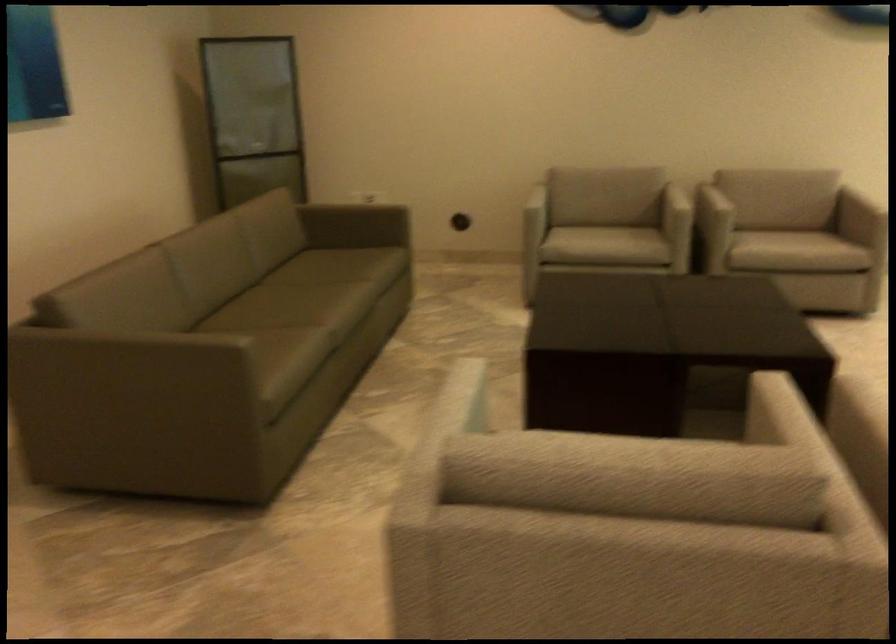
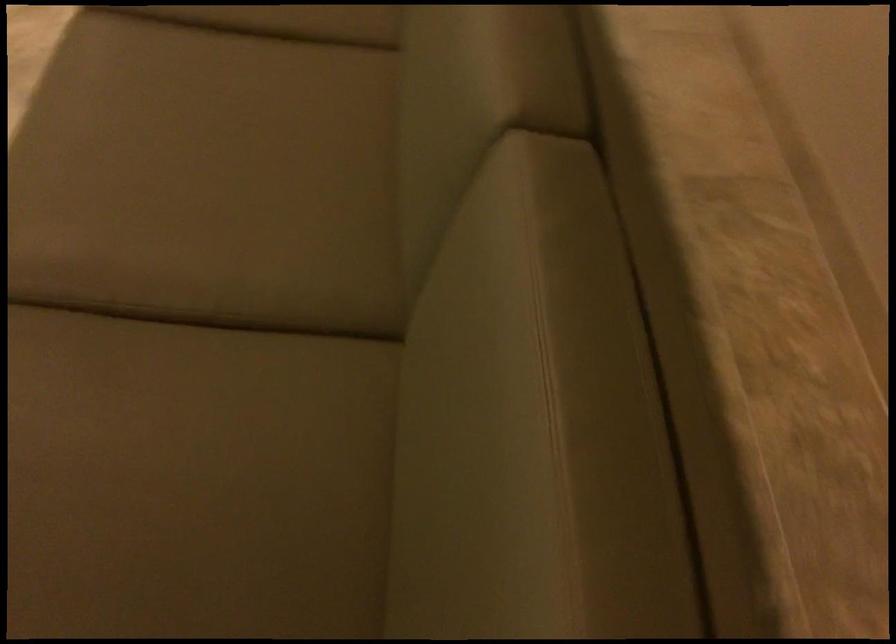
In the second image, find the point that corresponds to (x=231, y=334) in the first image.

(286, 20)